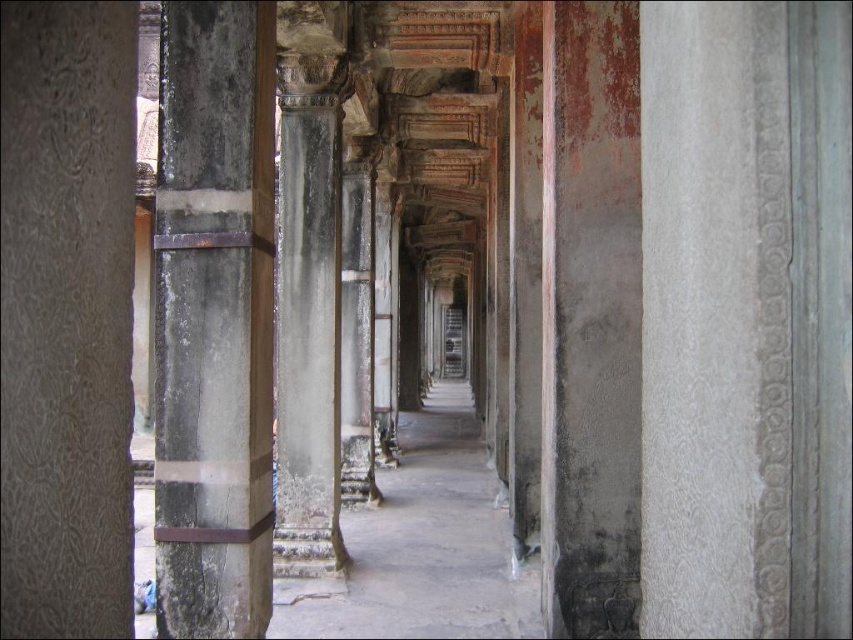
Question: Is gray textured stone pillar at left to the left of dark gray stone pillar at left from the viewer's perspective?

Choices:
 (A) yes
 (B) no

Answer: (B)

Question: Which of the following is the farthest from the observer?

Choices:
 (A) (91, 365)
 (B) (264, 592)

Answer: (B)

Question: Does gray textured stone pillar at left appear over dark gray stone pillar at left?

Choices:
 (A) no
 (B) yes

Answer: (B)

Question: Can you confirm if gray textured stone pillar at left is smaller than dark gray stone pillar at left?

Choices:
 (A) no
 (B) yes

Answer: (B)

Question: Which point appears closest to the camera in this image?

Choices:
 (A) (55, 502)
 (B) (209, 316)

Answer: (A)